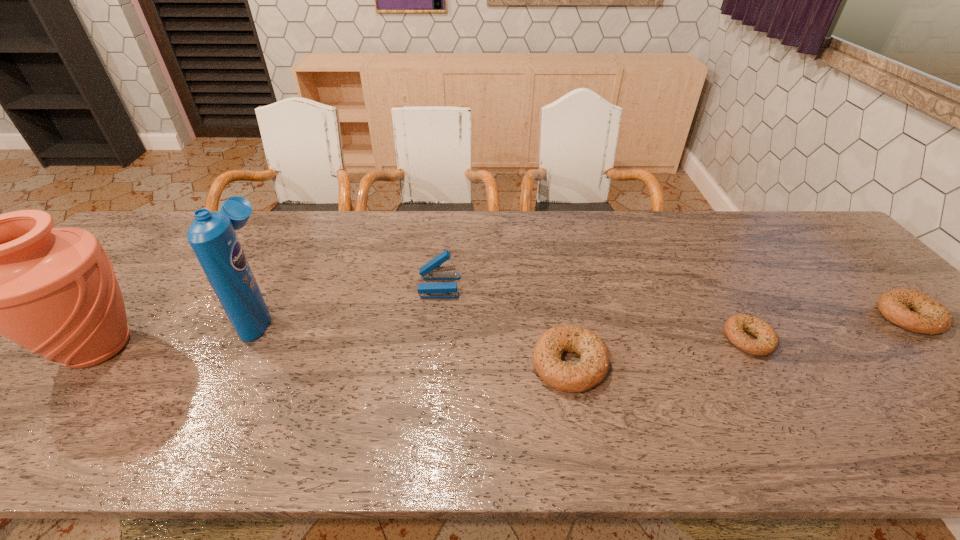
Locate an element on the screen. Image resolution: width=960 pixels, height=540 pixels. bagel that is the second closest to the third object from right to left is located at coordinates (928, 316).

Identify the location of free spot that satisfies the following two spatial constraints: 1. on the front side of the fourth object from right to left; 2. on the right side of the shortest object. This screenshot has height=540, width=960. (x=434, y=339).